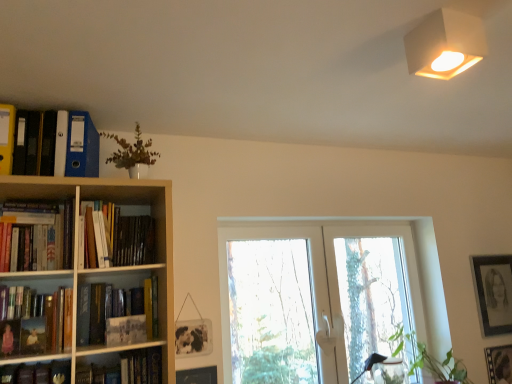
Find the location of a particular element. Image resolution: width=512 pixels, height=384 pixels. matte paper paperback at left is located at coordinates (125, 330).

In order to face hardcover books at left, the third book positioned from the bottom, should I rotate leftwards or rightwards?

Rotate your view left by about 17.859°.

From the picture: What is the approximate width of hardcover book at lower left, the first book from the bottom?

The width of hardcover book at lower left, the first book from the bottom, is 9.07 inches.

The height and width of the screenshot is (384, 512). I want to click on hardcover book at center-left, positioned as the second book in bottom-to-top order, so click(128, 314).

What do you see at coordinates (53, 144) in the screenshot?
I see `matte blue folder at upper left, marked as the first book in a top-to-bottom arrangement` at bounding box center [53, 144].

From the picture: How much space does matte black picture frame at lower right, which ranks as the 2th picture frame in right-to-left order, occupy horizontally?

matte black picture frame at lower right, which ranks as the 2th picture frame in right-to-left order, is 1.04 inches wide.

Image resolution: width=512 pixels, height=384 pixels. I want to click on matte black picture frame at lower right, acting as the second picture frame starting from the left, so click(499, 364).

How much space does black matte picture frame at upper right, placed as the third picture frame when sorted from left to right, occupy vertically?

black matte picture frame at upper right, placed as the third picture frame when sorted from left to right, is 20.50 inches tall.

What are the coordinates of `white matte lampshade at upper right` in the screenshot? It's located at (445, 44).

From the image's perspective, is matte white vase at upper left, marked as the 2th plant in a bottom-to-top arrangement, above matte paper paperback at left?

A: Yes, from the image's perspective, matte white vase at upper left, marked as the 2th plant in a bottom-to-top arrangement, is on top of matte paper paperback at left.

Is matte white vase at upper left, marked as the first plant in a left-to-right arrangement, aimed at matte paper paperback at left?

No, matte white vase at upper left, marked as the first plant in a left-to-right arrangement, does not turn towards matte paper paperback at left.

Looking at this image, how many degrees apart are the facing directions of matte white vase at upper left, marked as the first plant in a left-to-right arrangement, and matte paper paperback at left?

The angular difference between matte white vase at upper left, marked as the first plant in a left-to-right arrangement, and matte paper paperback at left is 0.00484 degrees.

From the image's perspective, is matte white vase at upper left, which is the first plant from top to bottom, positioned above or below matte blue folder at upper left, which is counted as the fourth book, starting from the bottom?

matte white vase at upper left, which is the first plant from top to bottom, is situated higher than matte blue folder at upper left, which is counted as the fourth book, starting from the bottom, in the image.

Is matte white vase at upper left, acting as the 2th plant starting from the back, closer to camera compared to matte blue folder at upper left, marked as the first book in a top-to-bottom arrangement?

Yes, matte white vase at upper left, acting as the 2th plant starting from the back, is closer to the camera.

Who is taller, matte white vase at upper left, the second plant positioned from the right, or matte blue folder at upper left, marked as the first book in a top-to-bottom arrangement?

With more height is matte white vase at upper left, the second plant positioned from the right.

Considering the relative positions of matte paper paperback at left and matte blue folder at upper left, marked as the first book in a top-to-bottom arrangement, in the image provided, is matte paper paperback at left to the right of matte blue folder at upper left, marked as the first book in a top-to-bottom arrangement, from the viewer's perspective?

Yes.

Does point (116, 319) come in front of point (76, 167)?

Yes, point (116, 319) is in front of point (76, 167).

Is matte blue folder at upper left, marked as the first book in a top-to-bottom arrangement, at the back of matte paper paperback at left?

No, matte paper paperback at left is not facing the opposite direction of matte blue folder at upper left, marked as the first book in a top-to-bottom arrangement.

Do you think matte paper paperback at left is within matte blue folder at upper left, which is counted as the fourth book, starting from the bottom, or outside of it?

matte paper paperback at left is not enclosed by matte blue folder at upper left, which is counted as the fourth book, starting from the bottom.

What are the coordinates of `lamp in front of the black matte picture frame at upper right, the third picture frame positioned from the front` in the screenshot? It's located at coord(445,44).

Is black matte picture frame at upper right, the third picture frame positioned from the front, taller or shorter than white matte lampshade at upper right?

Clearly, black matte picture frame at upper right, the third picture frame positioned from the front, is taller compared to white matte lampshade at upper right.

Is black matte picture frame at upper right, which is the first picture frame from top to bottom, facing away from white matte lampshade at upper right?

No.

Considering the sizes of objects black matte picture frame at upper right, placed as the third picture frame when sorted from left to right, and white matte lampshade at upper right in the image provided, who is smaller, black matte picture frame at upper right, placed as the third picture frame when sorted from left to right, or white matte lampshade at upper right?

black matte picture frame at upper right, placed as the third picture frame when sorted from left to right, is smaller.

Is matte black picture frame at lower right, the 3th picture frame when ordered from top to bottom, inside matte white vase at upper left, marked as the 2th plant in a bottom-to-top arrangement?

No.

Does matte white vase at upper left, the first plant from the front, have a larger size compared to matte black picture frame at lower right, which ranks as the second picture frame in front-to-back order?

Yes, matte white vase at upper left, the first plant from the front, is bigger than matte black picture frame at lower right, which ranks as the second picture frame in front-to-back order.

Can you confirm if matte white vase at upper left, which is the first plant from top to bottom, is shorter than matte black picture frame at lower right, which ranks as the 2th picture frame in right-to-left order?

Correct, matte white vase at upper left, which is the first plant from top to bottom, is not as tall as matte black picture frame at lower right, which ranks as the 2th picture frame in right-to-left order.

Can you confirm if matte white vase at upper left, marked as the 2th plant in a bottom-to-top arrangement, is thinner than matte black picture frame at lower right, which is the 1th picture frame from bottom to top?

In fact, matte white vase at upper left, marked as the 2th plant in a bottom-to-top arrangement, might be wider than matte black picture frame at lower right, which is the 1th picture frame from bottom to top.

Is matte white vase at upper left, the second plant positioned from the right, not near wooden picture frame at lower center, which is counted as the first picture frame, starting from the front?

Yes, matte white vase at upper left, the second plant positioned from the right, is far from wooden picture frame at lower center, which is counted as the first picture frame, starting from the front.

Between matte white vase at upper left, acting as the 2th plant starting from the back, and wooden picture frame at lower center, placed as the 2th picture frame when sorted from top to bottom, which one has less height?

wooden picture frame at lower center, placed as the 2th picture frame when sorted from top to bottom.

Does point (137, 145) come farther from viewer compared to point (208, 367)?

That is False.

From the image's perspective, would you say transparent glass door at center is positioned over white matte lampshade at upper right?

Incorrect, from the image's perspective, transparent glass door at center is lower than white matte lampshade at upper right.

Is transparent glass door at center smaller than white matte lampshade at upper right?

No, transparent glass door at center is not smaller than white matte lampshade at upper right.

How distant is transparent glass door at center from white matte lampshade at upper right?

A distance of 1.30 meters exists between transparent glass door at center and white matte lampshade at upper right.

Where is `paperback book lying behind the matte white vase at upper left, the second plant positioned from the right`? Image resolution: width=512 pixels, height=384 pixels. paperback book lying behind the matte white vase at upper left, the second plant positioned from the right is located at coordinates (125, 330).

Where is `plant in front of the matte blue folder at upper left, which is counted as the fourth book, starting from the bottom`? This screenshot has height=384, width=512. plant in front of the matte blue folder at upper left, which is counted as the fourth book, starting from the bottom is located at coordinates (132, 154).

From the image, which object appears to be farther from matte white vase at upper left, the second plant positioned from the right, hardcover book at lower left, the first book from the bottom, or matte blue folder at upper left, which is counted as the fourth book, starting from the bottom?

Among the two, hardcover book at lower left, the first book from the bottom, is located further to matte white vase at upper left, the second plant positioned from the right.

Looking at the image, which one is located further to white matte lampshade at upper right, transparent glass door at center or matte blue folder at upper left, which is counted as the fourth book, starting from the bottom?

Based on the image, matte blue folder at upper left, which is counted as the fourth book, starting from the bottom, appears to be further to white matte lampshade at upper right.

Estimate the real-world distances between objects in this image. Which object is closer to transparent glass door at center, green leafy plant at lower right, positioned as the 1th plant in back-to-front order, or hardcover books at left, the third book positioned from the bottom?

green leafy plant at lower right, positioned as the 1th plant in back-to-front order, lies closer to transparent glass door at center than the other object.

From the image, which object appears to be farther from hardcover book at lower left, which is the 4th book in top-to-bottom order, black matte picture frame at upper right, the third picture frame positioned from the front, or matte paper paperback at left?

Among the two, black matte picture frame at upper right, the third picture frame positioned from the front, is located further to hardcover book at lower left, which is the 4th book in top-to-bottom order.

Looking at the image, which one is located closer to hardcover books at left, the third book positioned from the bottom, hardcover book at center-left, placed as the 3th book when sorted from top to bottom, or wooden picture frame at lower center, placed as the 2th picture frame when sorted from top to bottom?

hardcover book at center-left, placed as the 3th book when sorted from top to bottom, is closer to hardcover books at left, the third book positioned from the bottom.

From the image, which object appears to be farther from matte blue folder at upper left, which is counted as the fourth book, starting from the bottom, wooden picture frame at lower center, acting as the third picture frame starting from the back, or matte black picture frame at lower right, acting as the second picture frame starting from the left?

matte black picture frame at lower right, acting as the second picture frame starting from the left.

Based on their spatial positions, is green leafy plant at lower right, which is the second plant in top-to-bottom order, or transparent glass door at center closer to hardcover books at left, the second book from the top?

Among the two, transparent glass door at center is located nearer to hardcover books at left, the second book from the top.

Which object lies further to the anchor point black matte picture frame at upper right, the 1th picture frame viewed from the right, hardcover book at center-left, placed as the 3th book when sorted from top to bottom, or wooden picture frame at lower center, acting as the 3th picture frame starting from the right?

Based on the image, hardcover book at center-left, placed as the 3th book when sorted from top to bottom, appears to be further to black matte picture frame at upper right, the 1th picture frame viewed from the right.

Locate an element on the screen. The height and width of the screenshot is (384, 512). paperback book between hardcover book at center-left, positioned as the second book in bottom-to-top order, and white matte lampshade at upper right from left to right is located at coordinates (125, 330).

At what (x,y) coordinates should I click in order to perform the action: click on paperback book between hardcover book at center-left, placed as the 3th book when sorted from top to bottom, and green leafy plant at lower right, placed as the 2th plant when sorted from left to right, from left to right. Please return your answer as a coordinate pair (x, y). Image resolution: width=512 pixels, height=384 pixels. Looking at the image, I should click on (125, 330).

At what (x,y) coordinates should I click in order to perform the action: click on picture frame between transparent glass door at center and black matte picture frame at upper right, placed as the first picture frame when sorted from back to front, in the horizontal direction. Please return your answer as a coordinate pair (x, y). Looking at the image, I should click on (499, 364).

I want to click on picture frame between matte paper paperback at left and matte black picture frame at lower right, the 3th picture frame when ordered from top to bottom, so click(197, 375).